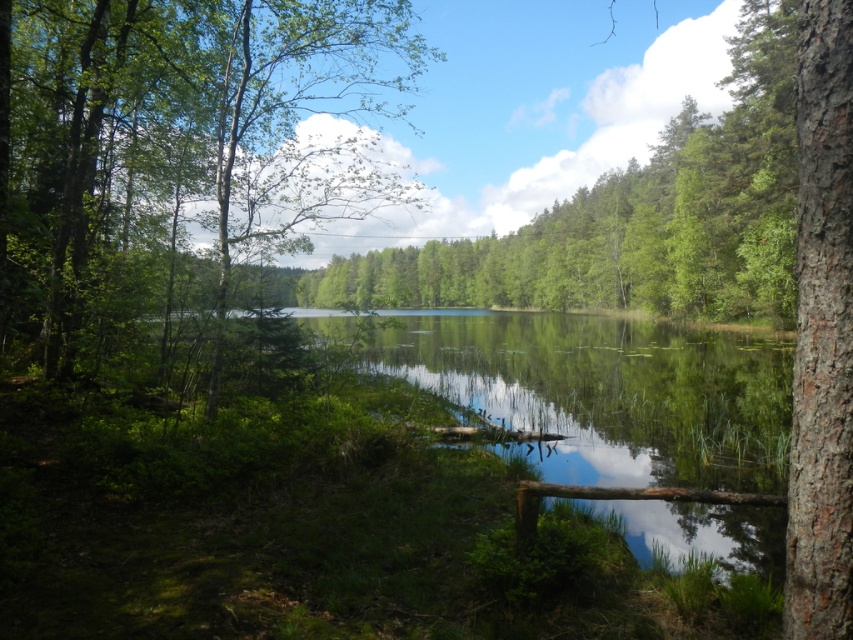
You are standing in the forest and want to walk towards the green leafy tree at center. Which direction should you move relative to the green leafy tree at left?

You should move to the right relative to the green leafy tree at left because the green leafy tree at center is to the right of the green leafy tree at left.

Looking at this image, you are standing in the forest and want to find the green reflective water at center. According to the coordinates provided, where should you look relative to your current position?

The green reflective water at center is located at coordinates point (595,388), so you should look towards the center area of the scene to find it.

You are an environmental scientist analyzing the image. You notice the green reflective water at center and the green leafy tree at center. Which object takes up more area in the image?

The green leafy tree at center occupies more space than the green reflective water at center, as stated in the description.